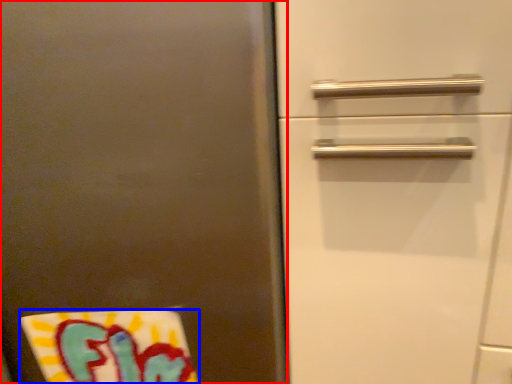
Question: Which object appears farthest to the camera in this image, door (highlighted by a red box) or beach towel (highlighted by a blue box)?

Choices:
 (A) door
 (B) beach towel

Answer: (B)